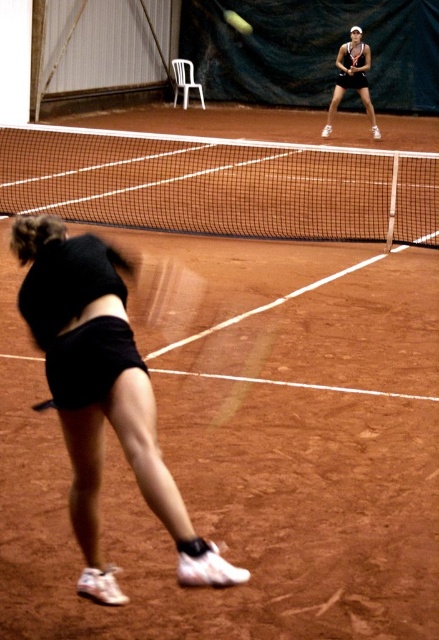
Question: Can you confirm if matte black tennis racket at upper center is thinner than yellow matte tennis ball at center?

Choices:
 (A) no
 (B) yes

Answer: (A)

Question: Which object is positioned closest to the matte black tennis racket at upper center?

Choices:
 (A) black mesh tennis net at center
 (B) yellow matte tennis ball at center
 (C) black matte shorts at lower left

Answer: (A)

Question: Which object is positioned closest to the matte black tennis racket at upper center?

Choices:
 (A) black mesh tennis net at center
 (B) yellow matte tennis ball at center

Answer: (A)

Question: Based on their relative distances, which object is farther from the matte black tennis racket at upper center?

Choices:
 (A) yellow matte tennis ball at center
 (B) black matte shorts at lower left

Answer: (B)

Question: Is black matte shorts at lower left closer to camera compared to yellow matte tennis ball at center?

Choices:
 (A) yes
 (B) no

Answer: (A)

Question: Is black mesh tennis net at center behind black matte shorts at lower left?

Choices:
 (A) yes
 (B) no

Answer: (A)